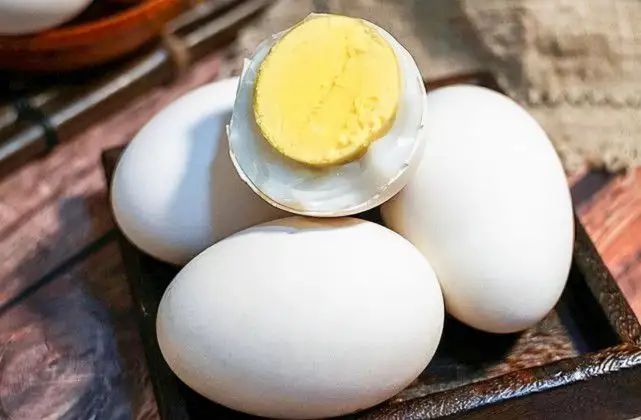
This screenshot has height=420, width=641. What are the coordinates of `bowl[` in the screenshot? It's located at (117, 43).